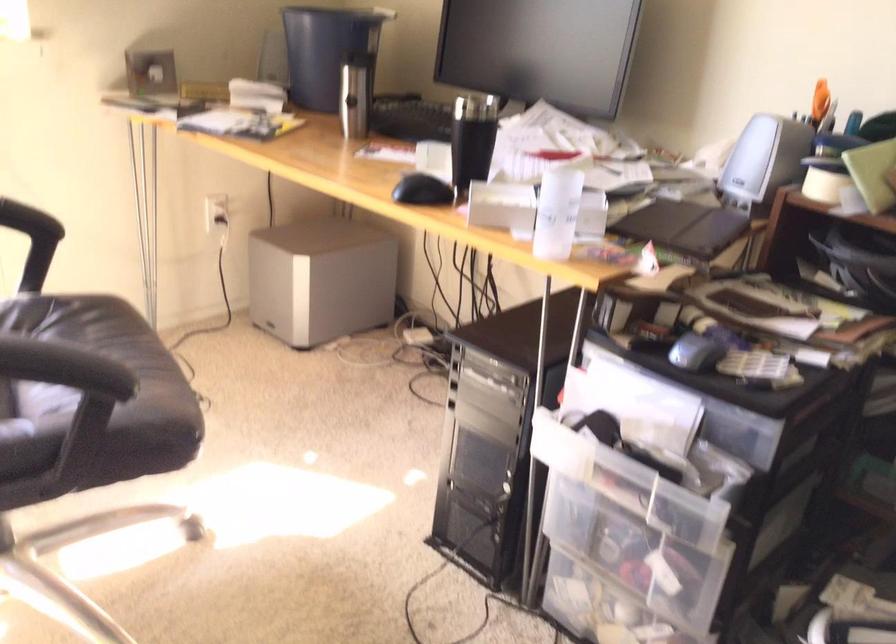
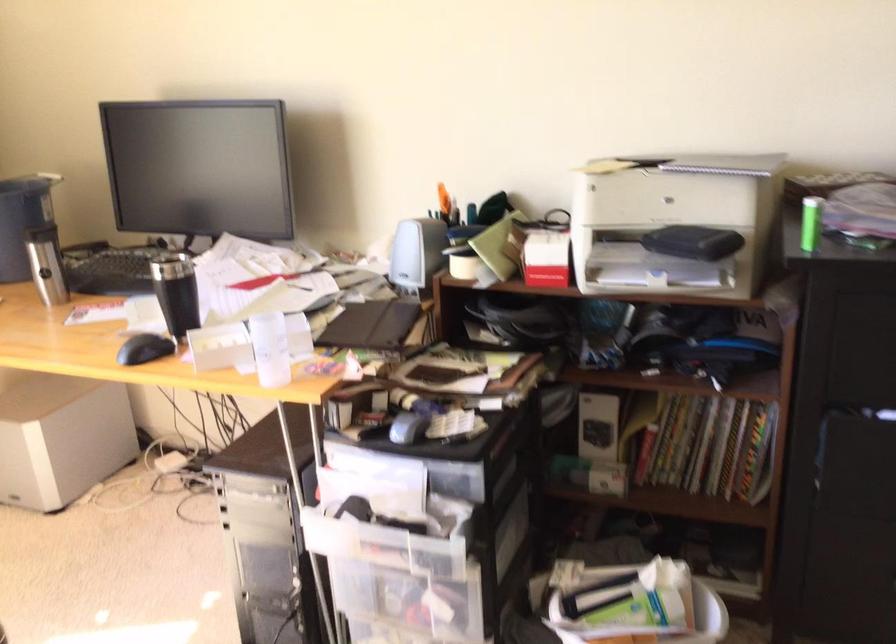
Locate, in the second image, the point that corresponds to (418,191) in the first image.

(143, 348)